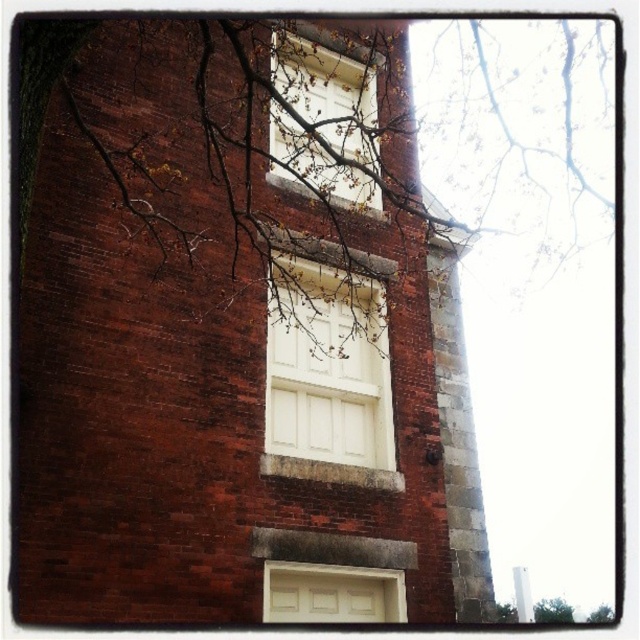
You are standing in front of the brick building and want to take a photo of the white matte window at upper center without the green leafy tree at lower right blocking the view. Is the tree in front of or behind the window?

The green leafy tree at lower right is behind the white matte window at upper center since the window is closer to the viewer. Therefore, the tree won

You are standing in front of the brick building and notice two points marked on the wall. The first point is at coordinate point(305,88) and the second is at point(589,612). Which point is closer to your current position?

Point(305,88) is closer to the camera than point(589,612), so the first point is closer to your current position.

You are standing in front of the brick building and notice a point marked at coordinates (300, 136). What is located at that point?

The point at (300, 136) indicates bare branches at upper center.